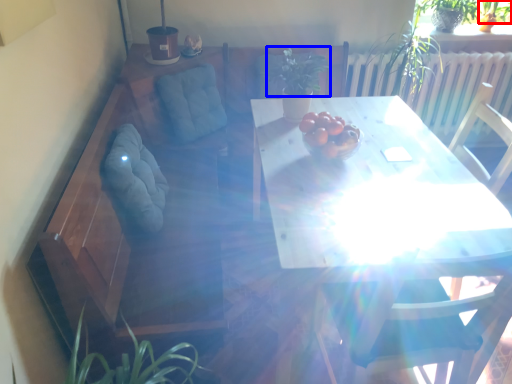
Question: Which of the following is the closest to the observer, plant (highlighted by a red box) or plant (highlighted by a blue box)?

Choices:
 (A) plant
 (B) plant

Answer: (B)